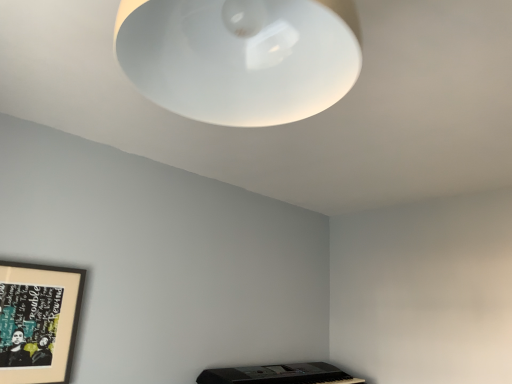
What do you see at coordinates (38, 321) in the screenshot? I see `wooden framed artwork at lower left` at bounding box center [38, 321].

From the picture: In order to face wooden framed artwork at lower left, should I rotate leftwards or rightwards?

To face it directly, rotate left by 27.456 degrees.

Where is `wooden framed artwork at lower left`? The height and width of the screenshot is (384, 512). wooden framed artwork at lower left is located at coordinates (38, 321).

What do you see at coordinates (240, 57) in the screenshot?
I see `white matte lampshade at upper center` at bounding box center [240, 57].

Find the location of a particular element. The height and width of the screenshot is (384, 512). white matte lampshade at upper center is located at coordinates (240, 57).

What are the coordinates of `wooden framed artwork at lower left` in the screenshot? It's located at (38, 321).

Is white matte lampshade at upper center to the left or to the right of wooden framed artwork at lower left in the image?

white matte lampshade at upper center is to the right of wooden framed artwork at lower left.

Which object is further away from the camera taking this photo, white matte lampshade at upper center or wooden framed artwork at lower left?

wooden framed artwork at lower left is further from the camera.

Considering the positions of point (205, 2) and point (58, 283), is point (205, 2) closer or farther from the camera than point (58, 283)?

Point (205, 2) appears to be closer to the viewer than point (58, 283).

From the picture: From the image's perspective, relative to wooden framed artwork at lower left, is white matte lampshade at upper center above or below?

white matte lampshade at upper center is above wooden framed artwork at lower left.

From a real-world perspective, who is located higher, white matte lampshade at upper center or wooden framed artwork at lower left?

white matte lampshade at upper center.

Which object is thinner, white matte lampshade at upper center or wooden framed artwork at lower left?

wooden framed artwork at lower left is thinner.

Which of these two, white matte lampshade at upper center or wooden framed artwork at lower left, stands shorter?

Standing shorter between the two is white matte lampshade at upper center.

Considering the sizes of objects white matte lampshade at upper center and wooden framed artwork at lower left in the image provided, who is bigger, white matte lampshade at upper center or wooden framed artwork at lower left?

white matte lampshade at upper center is bigger.

Does white matte lampshade at upper center contain wooden framed artwork at lower left?

That's incorrect, wooden framed artwork at lower left is not inside white matte lampshade at upper center.

Is white matte lampshade at upper center positioned far away from wooden framed artwork at lower left?

Yes.

Is white matte lampshade at upper center looking in the opposite direction of wooden framed artwork at lower left?

No, white matte lampshade at upper center's orientation is not away from wooden framed artwork at lower left.

Can you tell me how much white matte lampshade at upper center and wooden framed artwork at lower left differ in facing direction?

The facing directions of white matte lampshade at upper center and wooden framed artwork at lower left are 90.7 degrees apart.

The width and height of the screenshot is (512, 384). In the image, there is a wooden framed artwork at lower left. Identify the location of lamp above it (from the image's perspective). (240, 57).

Can you confirm if wooden framed artwork at lower left is positioned to the left of white matte lampshade at upper center?

Yes, wooden framed artwork at lower left is to the left of white matte lampshade at upper center.

Which object is more forward, wooden framed artwork at lower left or white matte lampshade at upper center?

white matte lampshade at upper center is more forward.

Does point (74, 298) come behind point (341, 71)?

That is True.

From the image's perspective, between wooden framed artwork at lower left and white matte lampshade at upper center, which one is located above?

white matte lampshade at upper center.

From a real-world perspective, is wooden framed artwork at lower left below white matte lampshade at upper center?

Correct, in the physical world, wooden framed artwork at lower left is lower than white matte lampshade at upper center.

Which object is thinner, wooden framed artwork at lower left or white matte lampshade at upper center?

wooden framed artwork at lower left.

Which of these two, wooden framed artwork at lower left or white matte lampshade at upper center, stands taller?

Standing taller between the two is wooden framed artwork at lower left.

Can you confirm if wooden framed artwork at lower left is bigger than white matte lampshade at upper center?

No, wooden framed artwork at lower left is not bigger than white matte lampshade at upper center.

Is wooden framed artwork at lower left located outside white matte lampshade at upper center?

That's correct, wooden framed artwork at lower left is outside of white matte lampshade at upper center.

Is the surface of wooden framed artwork at lower left in direct contact with white matte lampshade at upper center?

wooden framed artwork at lower left and white matte lampshade at upper center are not in contact.

Could you tell me if wooden framed artwork at lower left is facing white matte lampshade at upper center?

Yes.

How many degrees apart are the facing directions of wooden framed artwork at lower left and white matte lampshade at upper center?

90.7 degrees.

You are a GUI agent. You are given a task and a screenshot of the screen. Output one action in this format:
    pyautogui.click(x=<x>, y=<y>)
    Task: Click on the lamp located above the wooden framed artwork at lower left (from a real-world perspective)
    Image resolution: width=512 pixels, height=384 pixels.
    Given the screenshot: What is the action you would take?
    pyautogui.click(x=240, y=57)

At what (x,y) coordinates should I click in order to perform the action: click on picture frame that is on the left side of white matte lampshade at upper center. Please return your answer as a coordinate pair (x, y). The height and width of the screenshot is (384, 512). Looking at the image, I should click on (38, 321).

You are a GUI agent. You are given a task and a screenshot of the screen. Output one action in this format:
    pyautogui.click(x=<x>, y=<y>)
    Task: Click on the lamp that is on the right side of wooden framed artwork at lower left
    The height and width of the screenshot is (384, 512).
    Given the screenshot: What is the action you would take?
    pyautogui.click(x=240, y=57)